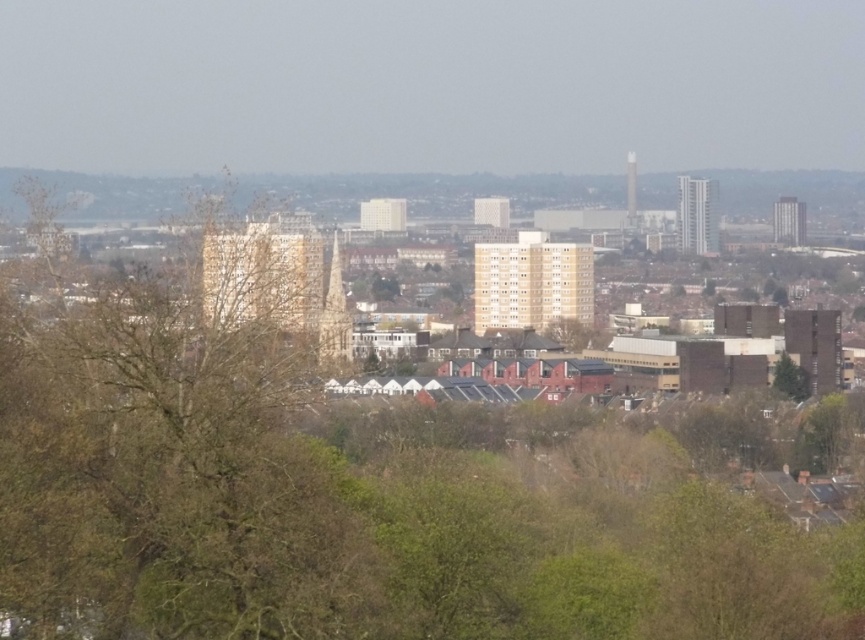
Question: Which point is closer to the camera taking this photo?

Choices:
 (A) (777, 364)
 (B) (828, 403)
 (C) (348, 621)

Answer: (C)

Question: Which point is farther from the camera taking this photo?

Choices:
 (A) (780, 392)
 (B) (322, 513)
 (C) (853, 417)
 (D) (212, 476)

Answer: (C)

Question: Considering the real-world distances, which object is closest to the brown leafless tree at left?

Choices:
 (A) green leafy tree at center-right
 (B) green leafy tree at center

Answer: (B)

Question: Can you confirm if green leafy tree at lower right is positioned to the left of green leafy tree at center-right?

Choices:
 (A) yes
 (B) no

Answer: (B)

Question: Is brown leafless tree at left bigger than green leafy tree at center-right?

Choices:
 (A) no
 (B) yes

Answer: (B)

Question: Can you confirm if green leafy tree at lower right is positioned to the left of green leafy tree at center-right?

Choices:
 (A) no
 (B) yes

Answer: (A)